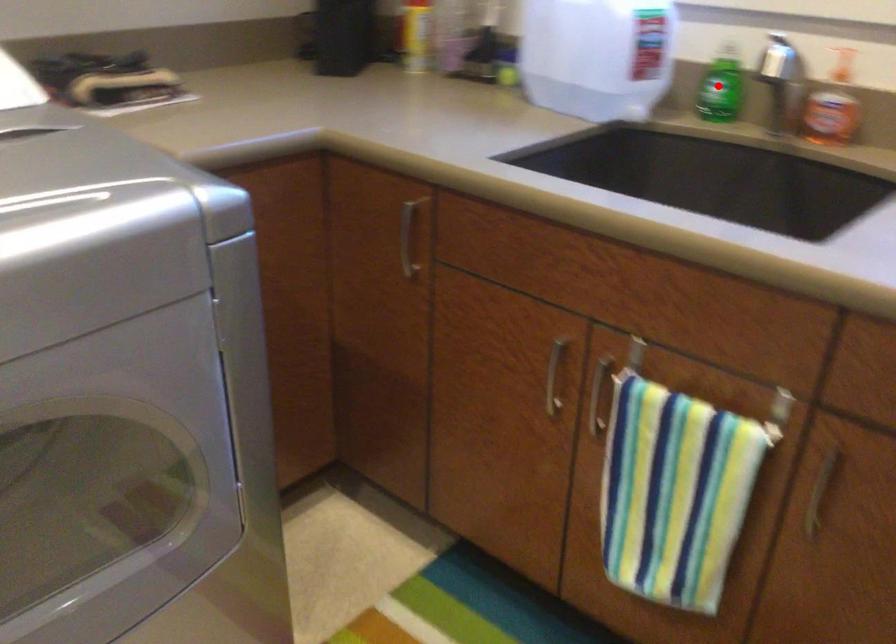
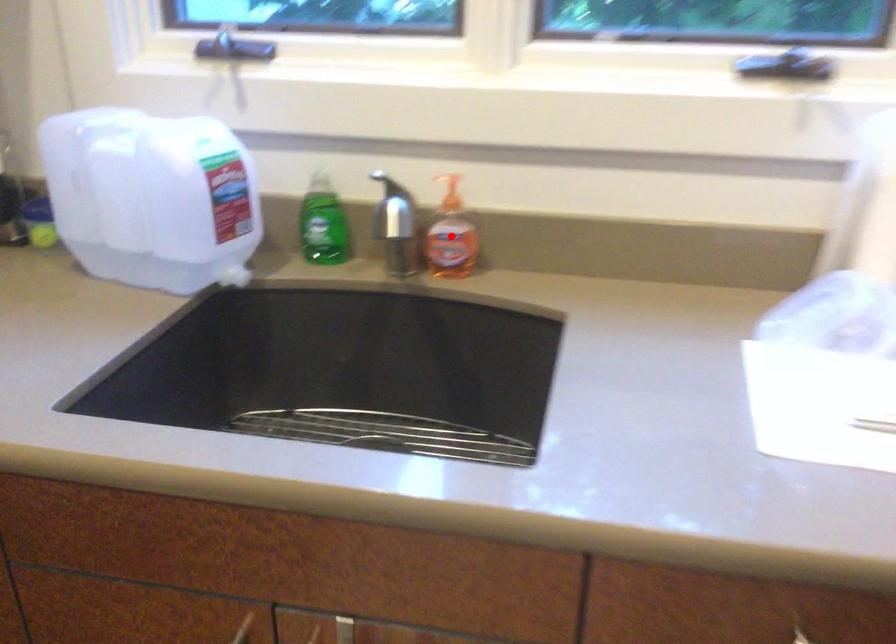
I am providing you with two images of the same scene from different viewpoints. A red point is marked on the first image and another point is marked on the second image. Does the point marked in image1 correspond to the same location as the one in image2?

No